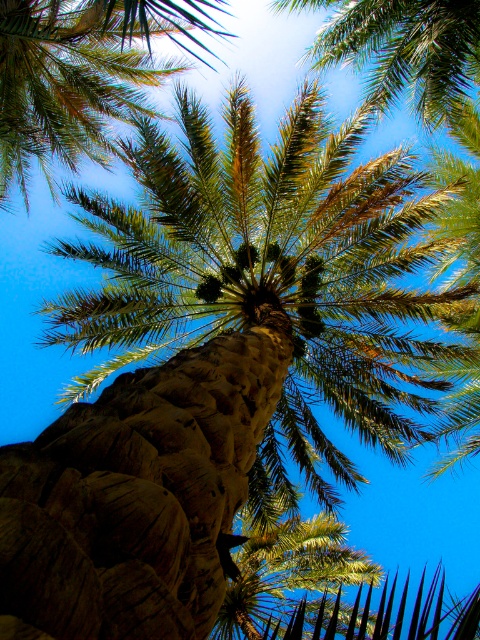
Who is more distant from viewer, (x=96, y=128) or (x=387, y=0)?

Point (x=96, y=128)

Which of these two, green leafy palm at center or green leafy palm at upper center, stands shorter?

green leafy palm at upper center is shorter.

Who is more forward, (49, 115) or (465, 1)?

Point (465, 1) is in front.

Find the location of a particular element. green leafy palm at center is located at coordinates (82, 76).